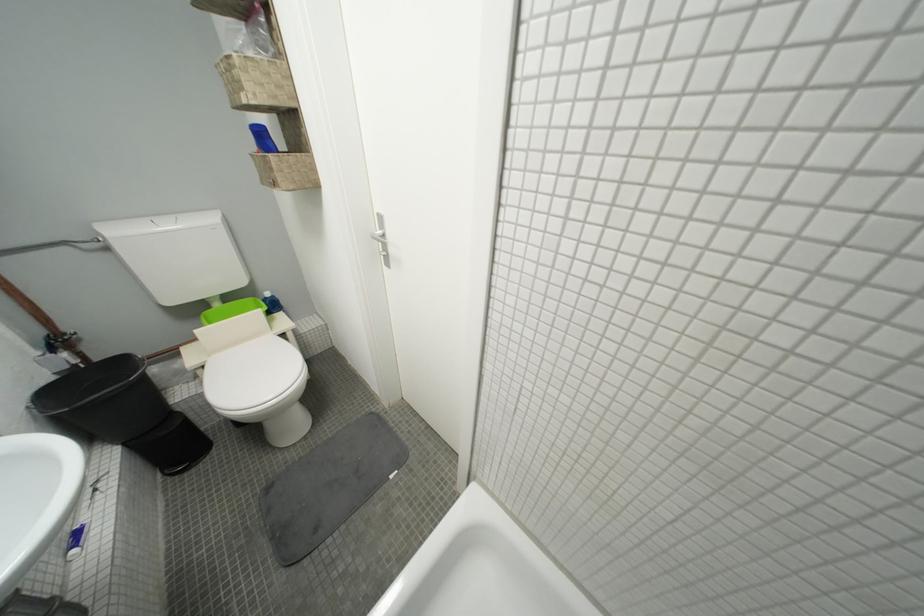
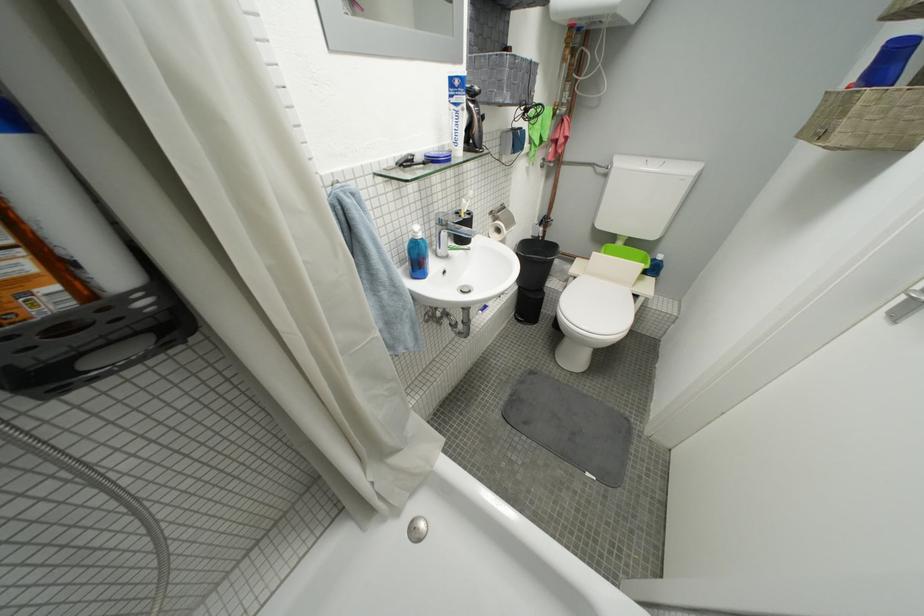
Locate, in the second image, the point that corresponds to pixel 213 370 in the first image.

(584, 281)